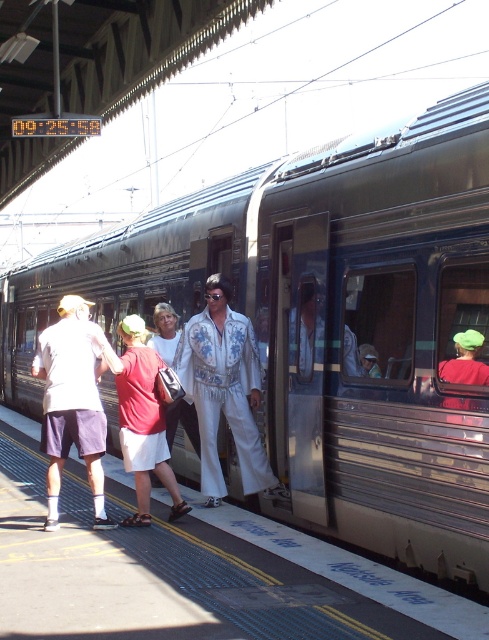
Between point (254, 342) and point (150, 436), which one is positioned behind?

Positioned behind is point (254, 342).

Between white satin suit at center and red cotton shirt at center, which one is positioned higher?

white satin suit at center is above.

Which is behind, point (244, 464) or point (176, 483)?

Positioned behind is point (244, 464).

Locate an element on the screen. This screenshot has width=489, height=640. white satin suit at center is located at coordinates (224, 392).

Is the position of matte white shirt at left more distant than that of red cotton shirt at center?

No.

Can you confirm if matte white shirt at left is positioned to the left of red cotton shirt at center?

Correct, you'll find matte white shirt at left to the left of red cotton shirt at center.

I want to click on matte white shirt at left, so click(73, 400).

From the picture: Who is taller, white satin suit at center or matte white shirt at left?

white satin suit at center

Based on the photo, can you confirm if white satin suit at center is positioned to the right of matte white shirt at left?

Correct, you'll find white satin suit at center to the right of matte white shirt at left.

Does point (235, 433) come behind point (80, 420)?

Yes, it is.

The width and height of the screenshot is (489, 640). Find the location of `white satin suit at center`. white satin suit at center is located at coordinates (224, 392).